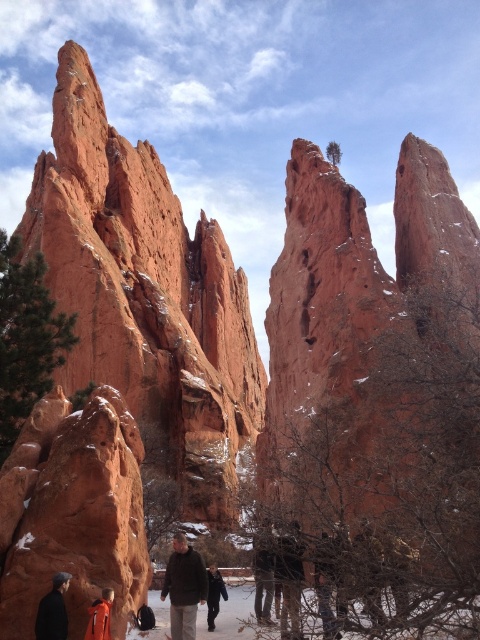
Question: From the image, what is the correct spatial relationship of dark brown leather jacket at center in relation to orange fabric jacket at lower left?

Choices:
 (A) left
 (B) right

Answer: (B)

Question: Which point appears closest to the camera in this image?

Choices:
 (A) (76, 540)
 (B) (212, 572)
 (C) (264, 552)

Answer: (A)

Question: Considering the real-world distances, which object is closest to the smooth reddish-brown rock at lower left?

Choices:
 (A) orange fabric jacket at lower left
 (B) rustic sandstone rock formation at center

Answer: (A)

Question: Estimate the real-world distances between objects in this image. Which object is closer to the orange fabric jacket at lower left?

Choices:
 (A) brown woolen jacket at center
 (B) dark brown leather jacket at lower left
 (C) smooth reddish-brown rock at lower left
 (D) dark blue jacket at lower center

Answer: (B)

Question: Does smooth reddish-brown rock at lower left appear under brown woolen jacket at center?

Choices:
 (A) yes
 (B) no

Answer: (B)

Question: Can you confirm if rustic sandstone rock formation at center is positioned to the right of dark brown leather jacket at lower left?

Choices:
 (A) no
 (B) yes

Answer: (A)